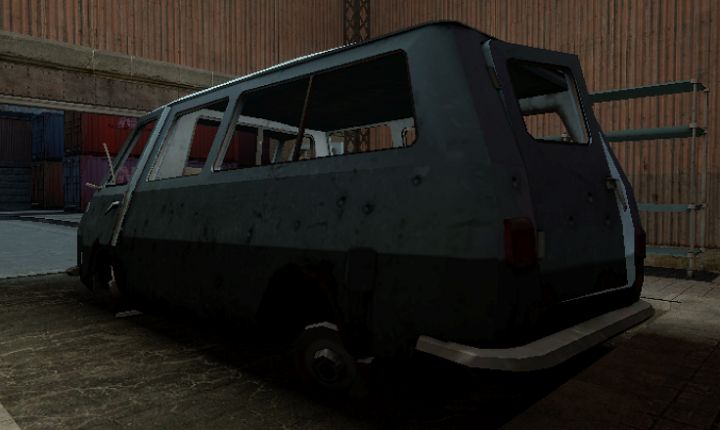
The height and width of the screenshot is (430, 720). What are the coordinates of `door handle` in the screenshot? It's located at (111, 206).